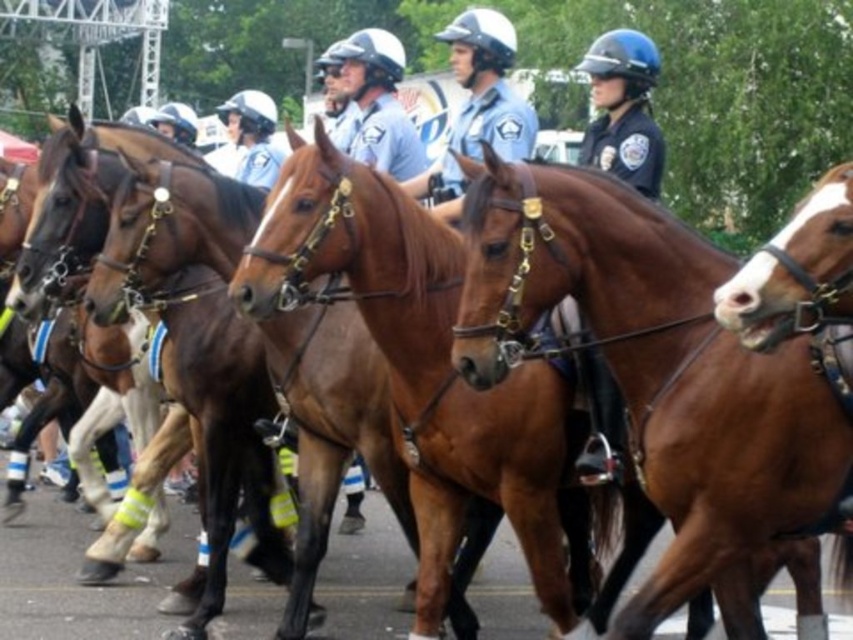
Question: Is matte blue uniform at center positioned at the back of glossy blue helmet at center?

Choices:
 (A) no
 (B) yes

Answer: (A)

Question: Does matte blue uniform at center have a lesser width compared to glossy blue helmet at center?

Choices:
 (A) yes
 (B) no

Answer: (B)

Question: Which point is closer to the camera?

Choices:
 (A) glossy blue helmet at center
 (B) matte blue uniform at center

Answer: (B)

Question: Does matte blue uniform at center have a greater width compared to glossy blue helmet at center?

Choices:
 (A) yes
 (B) no

Answer: (A)